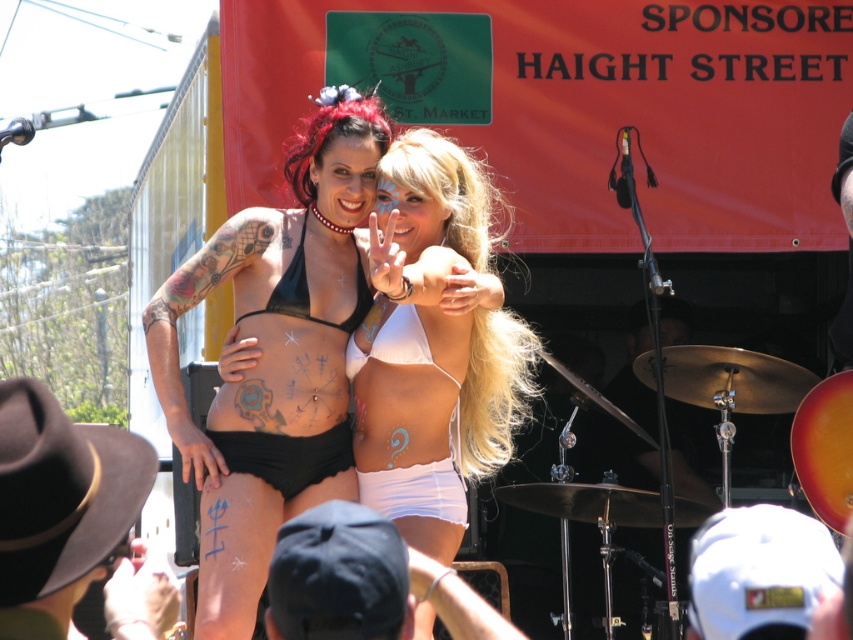
You are organizing a fashion show and need to decide whether the white fabric cap at center can be worn with the pearl necklace at center without overlapping. Based on their widths, can they be worn together comfortably?

The white fabric cap at center might be wider than pearl necklace at center, so there is a possibility they could overlap if worn together. It is advisable to check the exact measurements before deciding.

You are a photographer at the event and want to take a picture of both the black fabric cap at lower center and the white fabric cap at center. Which cap should you focus on first to ensure both are in frame?

The black fabric cap at lower center is larger in size compared to the white fabric cap at center. To ensure both are in frame, focus on the larger black fabric cap first as it requires more space, then adjust to include the smaller white one.